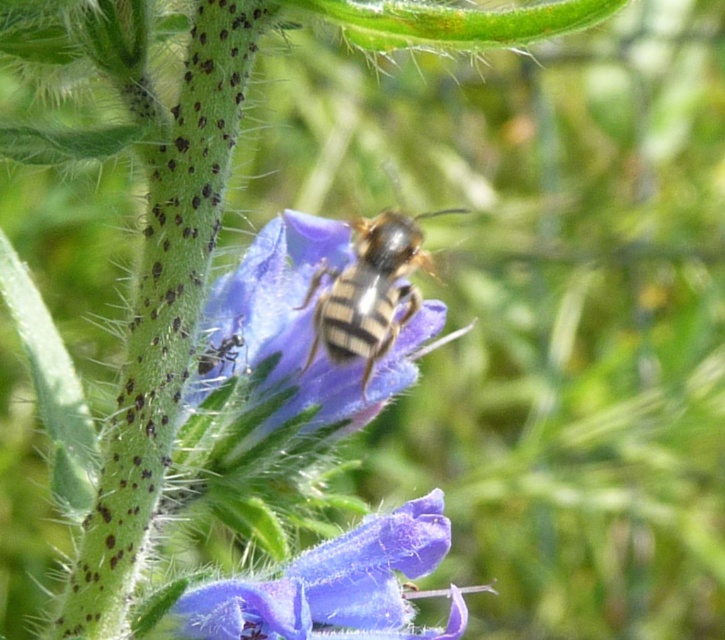
Who is positioned more to the left, purple matte flower at center or striped fur bee at center?

purple matte flower at center is more to the left.

Consider the image. Is purple matte flower at center positioned behind striped fur bee at center?

No, purple matte flower at center is closer to the viewer.

In order to click on purple matte flower at center in this screenshot , I will do `click(336, 586)`.

Which of these two, smooth purple petal at center or purple matte flower at center, stands shorter?

purple matte flower at center is shorter.

Does smooth purple petal at center have a greater height compared to purple matte flower at center?

Yes.

Is point (343, 259) behind point (307, 556)?

Yes.

This screenshot has height=640, width=725. In order to click on smooth purple petal at center in this screenshot , I will do [x=291, y=342].

Is point (378, 378) closer to viewer compared to point (331, 282)?

No, it is not.

Is point (365, 419) closer to camera compared to point (392, 244)?

That is False.

The height and width of the screenshot is (640, 725). Find the location of `smooth purple petal at center`. smooth purple petal at center is located at coordinates (291, 342).